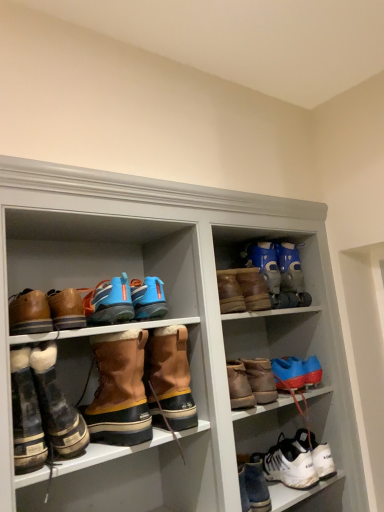
Question: Does brown leather boots at left, acting as the third footwear starting from the left, come in front of blue matte boot at upper right, the 2th footwear when ordered from right to left?

Choices:
 (A) no
 (B) yes

Answer: (B)

Question: Does brown leather boots at left, which is the eleventh footwear from right to left, have a greater height compared to blue matte boot at upper right, the 2th footwear when ordered from right to left?

Choices:
 (A) no
 (B) yes

Answer: (B)

Question: Is brown leather boots at left, acting as the third footwear starting from the left, aimed at blue matte boot at upper right, the 2th footwear when ordered from right to left?

Choices:
 (A) yes
 (B) no

Answer: (B)

Question: Considering the relative positions of brown leather boots at left, which is the eleventh footwear from right to left, and blue matte boot at upper right, positioned as the twelfth footwear in left-to-right order, in the image provided, is brown leather boots at left, which is the eleventh footwear from right to left, to the left of blue matte boot at upper right, positioned as the twelfth footwear in left-to-right order, from the viewer's perspective?

Choices:
 (A) yes
 (B) no

Answer: (A)

Question: Can you confirm if brown leather boots at left, which is the eleventh footwear from right to left, is smaller than blue matte boot at upper right, positioned as the twelfth footwear in left-to-right order?

Choices:
 (A) yes
 (B) no

Answer: (A)

Question: From the image's perspective, is blue synthetic ski boots at upper right, the eleventh footwear in the left-to-right sequence, positioned above or below white leather sneakers at lower right, which is the 1th footwear from right to left?

Choices:
 (A) above
 (B) below

Answer: (A)

Question: Is blue synthetic ski boots at upper right, the eleventh footwear in the left-to-right sequence, bigger or smaller than white leather sneakers at lower right, which is the 1th footwear from right to left?

Choices:
 (A) small
 (B) big

Answer: (B)

Question: Considering the positions of point (299, 296) and point (321, 467), is point (299, 296) closer or farther from the camera than point (321, 467)?

Choices:
 (A) farther
 (B) closer

Answer: (A)

Question: Is blue synthetic ski boots at upper right, the eleventh footwear in the left-to-right sequence, in front of or behind white leather sneakers at lower right, which is the 1th footwear from right to left, in the image?

Choices:
 (A) front
 (B) behind

Answer: (B)

Question: Considering the positions of point (233, 276) and point (109, 314), is point (233, 276) closer or farther from the camera than point (109, 314)?

Choices:
 (A) closer
 (B) farther

Answer: (B)

Question: In terms of size, does brown suede boots at upper right, which is the ninth footwear in left-to-right order, appear bigger or smaller than blue synthetic running shoes at center, which ranks as the 5th footwear in left-to-right order?

Choices:
 (A) big
 (B) small

Answer: (A)

Question: Is brown suede boots at upper right, placed as the fifth footwear when sorted from right to left, to the left or to the right of blue synthetic running shoes at center, which ranks as the 5th footwear in left-to-right order, in the image?

Choices:
 (A) right
 (B) left

Answer: (A)

Question: Is brown suede boots at upper right, which is the ninth footwear in left-to-right order, spatially inside blue synthetic running shoes at center, which ranks as the 5th footwear in left-to-right order, or outside of it?

Choices:
 (A) outside
 (B) inside

Answer: (A)

Question: In terms of width, does blue synthetic running shoes at center, acting as the 9th footwear starting from the right, look wider or thinner when compared to white leather sneakers at lower right, which appears as the thirteenth footwear when viewed from the left?

Choices:
 (A) wide
 (B) thin

Answer: (B)

Question: Is blue synthetic running shoes at center, which ranks as the 5th footwear in left-to-right order, taller or shorter than white leather sneakers at lower right, which appears as the thirteenth footwear when viewed from the left?

Choices:
 (A) tall
 (B) short

Answer: (A)